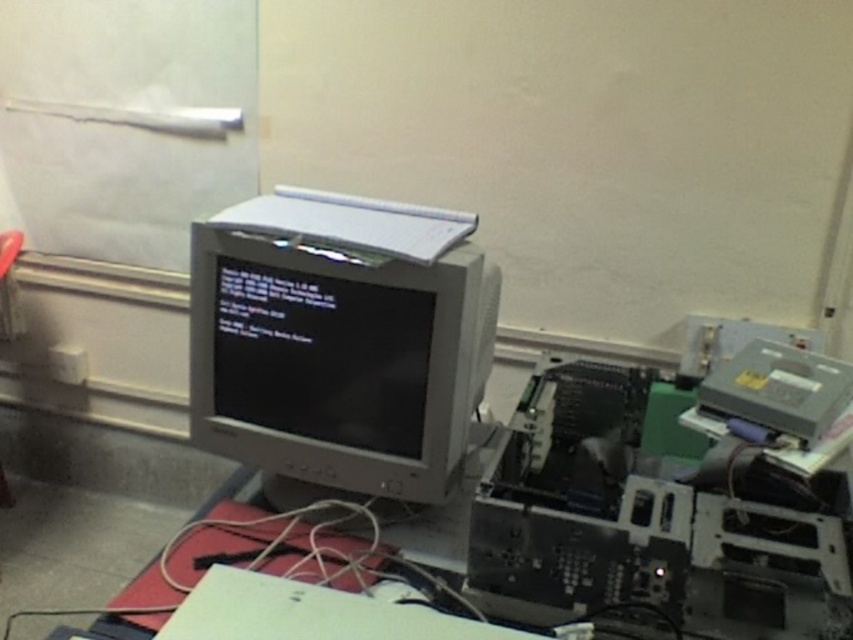
Question: Which point is closer to the camera taking this photo?

Choices:
 (A) (824, 387)
 (B) (293, 259)

Answer: (B)

Question: Is matte gray monitor at center to the right of gray plastic printer at right from the viewer's perspective?

Choices:
 (A) yes
 (B) no

Answer: (B)

Question: Which of the following is the closest to the observer?

Choices:
 (A) (430, 323)
 (B) (722, 412)

Answer: (A)

Question: In this image, where is matte gray monitor at center located relative to gray plastic printer at right?

Choices:
 (A) above
 (B) below

Answer: (A)

Question: Can you confirm if matte gray monitor at center is positioned above gray plastic printer at right?

Choices:
 (A) yes
 (B) no

Answer: (A)